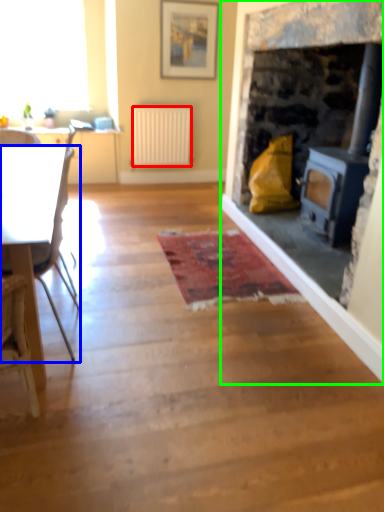
Question: Which object is positioned farthest from radiator (highlighted by a red box)? Select from chair (highlighted by a blue box) and fireplace (highlighted by a green box).

Choices:
 (A) chair
 (B) fireplace

Answer: (A)